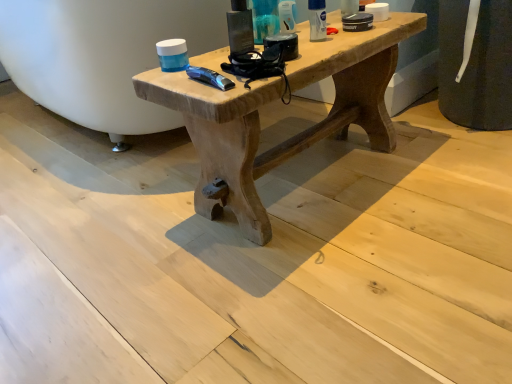
In order to click on matte plastic container at upper center, placed as the 3th toiletry when sorted from right to left in this screenshot , I will do `click(265, 19)`.

Image resolution: width=512 pixels, height=384 pixels. Describe the element at coordinates (265, 19) in the screenshot. I see `matte plastic container at upper center, placed as the 3th toiletry when sorted from right to left` at that location.

What do you see at coordinates (276, 99) in the screenshot?
I see `natural wood table at center` at bounding box center [276, 99].

Image resolution: width=512 pixels, height=384 pixels. What do you see at coordinates (287, 16) in the screenshot?
I see `translucent plastic tube at upper center, the second toiletry in the right-to-left sequence` at bounding box center [287, 16].

Describe the element at coordinates (317, 20) in the screenshot. I see `white matte deodorant at upper right, the first toiletry from the right` at that location.

You are a GUI agent. You are given a task and a screenshot of the screen. Output one action in this format:
    pyautogui.click(x=<x>, y=<y>)
    Task: Click on the matte plastic container at upper center, placed as the 3th toiletry when sorted from right to left
    
    Given the screenshot: What is the action you would take?
    pyautogui.click(x=265, y=19)

Is the position of white matte deodorant at upper right, positioned as the third toiletry in left-to-right order, more distant than that of translucent plastic tube at upper center, the second toiletry in the right-to-left sequence?

No, white matte deodorant at upper right, positioned as the third toiletry in left-to-right order, is closer to the viewer.

Are white matte deodorant at upper right, the first toiletry from the right, and translucent plastic tube at upper center, the second toiletry in the right-to-left sequence, far apart?

Actually, white matte deodorant at upper right, the first toiletry from the right, and translucent plastic tube at upper center, the second toiletry in the right-to-left sequence, are a little close together.

Consider the image. Is white matte deodorant at upper right, the first toiletry from the right, oriented towards translucent plastic tube at upper center, the second toiletry in the right-to-left sequence?

No, white matte deodorant at upper right, the first toiletry from the right, is not aimed at translucent plastic tube at upper center, the second toiletry in the right-to-left sequence.

Is white matte deodorant at upper right, positioned as the third toiletry in left-to-right order, taller or shorter than translucent plastic tube at upper center, the second toiletry viewed from the left?

Clearly, white matte deodorant at upper right, positioned as the third toiletry in left-to-right order, is shorter compared to translucent plastic tube at upper center, the second toiletry viewed from the left.

Based on the photo, is matte plastic container at upper center, the 1th toiletry viewed from the left, positioned with its back to natural wood table at center?

No, matte plastic container at upper center, the 1th toiletry viewed from the left, is not facing the opposite direction of natural wood table at center.

Is matte plastic container at upper center, placed as the 3th toiletry when sorted from right to left, directly adjacent to natural wood table at center?

matte plastic container at upper center, placed as the 3th toiletry when sorted from right to left, and natural wood table at center are clearly separated.

Considering the positions of objects matte plastic container at upper center, the 1th toiletry viewed from the left, and natural wood table at center in the image provided, who is in front, matte plastic container at upper center, the 1th toiletry viewed from the left, or natural wood table at center?

Positioned in front is natural wood table at center.

Looking at this image, is natural wood table at center inside matte plastic container at upper center, the 1th toiletry viewed from the left?

That's incorrect, natural wood table at center is not inside matte plastic container at upper center, the 1th toiletry viewed from the left.

Is translucent plastic tube at upper center, the second toiletry viewed from the left, located outside white matte deodorant at upper right, positioned as the third toiletry in left-to-right order?

Yes, translucent plastic tube at upper center, the second toiletry viewed from the left, is outside of white matte deodorant at upper right, positioned as the third toiletry in left-to-right order.

Consider the image. Can you tell me how much translucent plastic tube at upper center, the second toiletry viewed from the left, and white matte deodorant at upper right, the first toiletry from the right, differ in facing direction?

0.00386 degrees separate the facing orientations of translucent plastic tube at upper center, the second toiletry viewed from the left, and white matte deodorant at upper right, the first toiletry from the right.

Which object is closer to the camera taking this photo, translucent plastic tube at upper center, the second toiletry in the right-to-left sequence, or white matte deodorant at upper right, the first toiletry from the right?

white matte deodorant at upper right, the first toiletry from the right, is closer to the camera.

Which of these two, translucent plastic tube at upper center, the second toiletry viewed from the left, or white matte deodorant at upper right, positioned as the third toiletry in left-to-right order, stands shorter?

white matte deodorant at upper right, positioned as the third toiletry in left-to-right order.

Is white matte deodorant at upper right, positioned as the third toiletry in left-to-right order, with natural wood table at center?

white matte deodorant at upper right, positioned as the third toiletry in left-to-right order, is not next to natural wood table at center, and they're not touching.

Considering the positions of point (317, 28) and point (388, 45), is point (317, 28) closer or farther from the camera than point (388, 45)?

Point (317, 28).

From the image's perspective, is white matte deodorant at upper right, the first toiletry from the right, above or below natural wood table at center?

white matte deodorant at upper right, the first toiletry from the right, is situated higher than natural wood table at center in the image.

Is the position of white matte deodorant at upper right, positioned as the third toiletry in left-to-right order, less distant than that of natural wood table at center?

No, white matte deodorant at upper right, positioned as the third toiletry in left-to-right order, is behind natural wood table at center.

From the picture: Between natural wood table at center and white matte deodorant at upper right, positioned as the third toiletry in left-to-right order, which one is positioned in front?

natural wood table at center.

In order to click on table that is under the white matte deodorant at upper right, positioned as the third toiletry in left-to-right order (from a real-world perspective) in this screenshot , I will do `click(276, 99)`.

Does natural wood table at center appear on the left side of white matte deodorant at upper right, the first toiletry from the right?

Yes, natural wood table at center is to the left of white matte deodorant at upper right, the first toiletry from the right.

Which object is further away from the camera, natural wood table at center or matte plastic container at upper center, placed as the 3th toiletry when sorted from right to left?

matte plastic container at upper center, placed as the 3th toiletry when sorted from right to left, is further from the camera.

From a real-world perspective, which object stands above the other?

From a 3D spatial view, matte plastic container at upper center, the 1th toiletry viewed from the left, is above.

Is natural wood table at center aimed at matte plastic container at upper center, placed as the 3th toiletry when sorted from right to left?

No, natural wood table at center is not turned towards matte plastic container at upper center, placed as the 3th toiletry when sorted from right to left.

Which object is wider, natural wood table at center or matte plastic container at upper center, placed as the 3th toiletry when sorted from right to left?

natural wood table at center.

Identify the location of table on the right of translucent plastic tube at upper center, the second toiletry viewed from the left. The height and width of the screenshot is (384, 512). (276, 99).

Does translucent plastic tube at upper center, the second toiletry in the right-to-left sequence, touch natural wood table at center?

translucent plastic tube at upper center, the second toiletry in the right-to-left sequence, and natural wood table at center are not in contact.

Which of these two, translucent plastic tube at upper center, the second toiletry viewed from the left, or natural wood table at center, stands shorter?

With less height is translucent plastic tube at upper center, the second toiletry viewed from the left.

Considering the relative sizes of translucent plastic tube at upper center, the second toiletry in the right-to-left sequence, and natural wood table at center in the image provided, is translucent plastic tube at upper center, the second toiletry in the right-to-left sequence, bigger than natural wood table at center?

Actually, translucent plastic tube at upper center, the second toiletry in the right-to-left sequence, might be smaller than natural wood table at center.

The width and height of the screenshot is (512, 384). Identify the location of the 1st toiletry to the left when counting from the white matte deodorant at upper right, positioned as the third toiletry in left-to-right order. (287, 16).

Where is `table lying on the right of matte plastic container at upper center, the 1th toiletry viewed from the left`? This screenshot has width=512, height=384. table lying on the right of matte plastic container at upper center, the 1th toiletry viewed from the left is located at coordinates click(276, 99).

Looking at the image, which one is located further to matte plastic container at upper center, the 1th toiletry viewed from the left, white matte deodorant at upper right, the first toiletry from the right, or natural wood table at center?

natural wood table at center is further to matte plastic container at upper center, the 1th toiletry viewed from the left.

Which object lies nearer to the anchor point white matte deodorant at upper right, the first toiletry from the right, natural wood table at center or matte plastic container at upper center, placed as the 3th toiletry when sorted from right to left?

matte plastic container at upper center, placed as the 3th toiletry when sorted from right to left, is closer to white matte deodorant at upper right, the first toiletry from the right.

Looking at the image, which one is located closer to translucent plastic tube at upper center, the second toiletry viewed from the left, natural wood table at center or matte plastic container at upper center, placed as the 3th toiletry when sorted from right to left?

matte plastic container at upper center, placed as the 3th toiletry when sorted from right to left, lies closer to translucent plastic tube at upper center, the second toiletry viewed from the left, than the other object.

When comparing their distances from translucent plastic tube at upper center, the second toiletry viewed from the left, does white matte deodorant at upper right, the first toiletry from the right, or matte plastic container at upper center, the 1th toiletry viewed from the left, seem further?

The object further to translucent plastic tube at upper center, the second toiletry viewed from the left, is white matte deodorant at upper right, the first toiletry from the right.

Considering their positions, is matte plastic container at upper center, placed as the 3th toiletry when sorted from right to left, positioned closer to translucent plastic tube at upper center, the second toiletry viewed from the left, than natural wood table at center?

matte plastic container at upper center, placed as the 3th toiletry when sorted from right to left.

From the image, which object appears to be farther from matte plastic container at upper center, the 1th toiletry viewed from the left, white matte deodorant at upper right, positioned as the third toiletry in left-to-right order, or translucent plastic tube at upper center, the second toiletry in the right-to-left sequence?

The object further to matte plastic container at upper center, the 1th toiletry viewed from the left, is white matte deodorant at upper right, positioned as the third toiletry in left-to-right order.

Considering their positions, is translucent plastic tube at upper center, the second toiletry in the right-to-left sequence, positioned closer to white matte deodorant at upper right, the first toiletry from the right, than matte plastic container at upper center, the 1th toiletry viewed from the left?

Among the two, translucent plastic tube at upper center, the second toiletry in the right-to-left sequence, is located nearer to white matte deodorant at upper right, the first toiletry from the right.

Considering their positions, is natural wood table at center positioned closer to translucent plastic tube at upper center, the second toiletry in the right-to-left sequence, than white matte deodorant at upper right, the first toiletry from the right?

white matte deodorant at upper right, the first toiletry from the right, is positioned closer to the anchor translucent plastic tube at upper center, the second toiletry in the right-to-left sequence.

Locate an element on the screen. This screenshot has width=512, height=384. toiletry between matte plastic container at upper center, placed as the 3th toiletry when sorted from right to left, and natural wood table at center from top to bottom is located at coordinates (317, 20).

Identify the location of toiletry between matte plastic container at upper center, placed as the 3th toiletry when sorted from right to left, and white matte deodorant at upper right, positioned as the third toiletry in left-to-right order, from left to right. This screenshot has width=512, height=384. (287, 16).